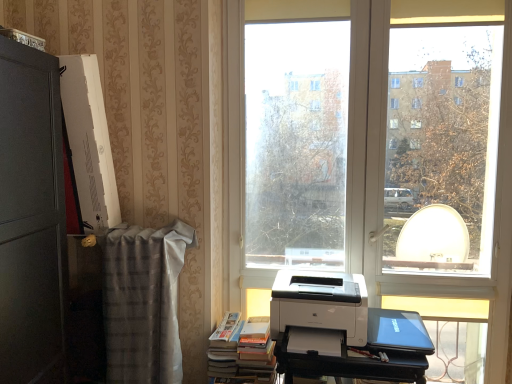
The image size is (512, 384). I want to click on plaid fabric at left, so click(x=143, y=302).

In order to face white glossy printer at center, should I rotate leftwards or rightwards?

To face it directly, rotate right by 8.618 degrees.

Where is `matte black laptop at lower right`? This screenshot has height=384, width=512. matte black laptop at lower right is located at coordinates (398, 331).

Identify the location of plaid fabric at left. (143, 302).

Which object is wider, black plastic printer at lower right or transparent glass window at center?

black plastic printer at lower right.

How much distance is there between black plastic printer at lower right and transparent glass window at center?

They are 32.61 inches apart.

From a real-world perspective, who is located higher, black plastic printer at lower right or transparent glass window at center?

From a 3D spatial view, transparent glass window at center is above.

Considering their positions, is black plastic printer at lower right located in front of or behind transparent glass window at center?

black plastic printer at lower right is positioned closer to the viewer than transparent glass window at center.

Considering the sizes of white glossy printer at center and transparent glass window at center in the image, is white glossy printer at center taller or shorter than transparent glass window at center?

Considering their sizes, white glossy printer at center has less height than transparent glass window at center.

Can we say white glossy printer at center lies outside transparent glass window at center?

Yes, white glossy printer at center is not within transparent glass window at center.

Which is closer, (312, 286) or (343, 223)?

The point (312, 286) is closer to the camera.

Based on their sizes in the image, would you say white glossy printer at center is bigger or smaller than transparent glass window at center?

Considering their sizes, white glossy printer at center takes up less space than transparent glass window at center.

From the image's perspective, would you say black plastic printer at lower right is shown under white glossy printer at center?

Indeed, from the image's perspective, black plastic printer at lower right is shown beneath white glossy printer at center.

From the picture: Considering the sizes of objects black plastic printer at lower right and white glossy printer at center in the image provided, who is thinner, black plastic printer at lower right or white glossy printer at center?

white glossy printer at center.

Who is smaller, black plastic printer at lower right or white glossy printer at center?

white glossy printer at center.

Is black plastic printer at lower right turned away from white glossy printer at center?

No, black plastic printer at lower right is not facing the opposite direction of white glossy printer at center.

Which is behind, point (174, 307) or point (317, 327)?

The point (174, 307) is more distant.

From a real-world perspective, is plaid fabric at left beneath white glossy printer at center?

Yes, from a real-world perspective, plaid fabric at left is under white glossy printer at center.

Considering the relative positions of plaid fabric at left and white glossy printer at center in the image provided, is plaid fabric at left to the right of white glossy printer at center from the viewer's perspective?

No, plaid fabric at left is not to the right of white glossy printer at center.

From the picture: Considering the relative sizes of hardcover books at lower left and white glossy printer at center in the image provided, is hardcover books at lower left bigger than white glossy printer at center?

Indeed, hardcover books at lower left has a larger size compared to white glossy printer at center.

What's the angular difference between hardcover books at lower left and white glossy printer at center's facing directions?

The angle between the facing direction of hardcover books at lower left and the facing direction of white glossy printer at center is 4.56 degrees.

Does hardcover books at lower left appear on the right side of white glossy printer at center?

No.

Does hardcover books at lower left have a lesser height compared to white glossy printer at center?

Incorrect, the height of hardcover books at lower left does not fall short of that of white glossy printer at center.

Which object is closer to the camera taking this photo, black plastic printer at lower right or plaid fabric at left?

black plastic printer at lower right is more forward.

From the image's perspective, is black plastic printer at lower right on top of plaid fabric at left?

Actually, black plastic printer at lower right appears below plaid fabric at left in the image.

From a real-world perspective, is black plastic printer at lower right on plaid fabric at left?

No, from a real-world perspective, black plastic printer at lower right is not on top of plaid fabric at left.

Who is shorter, black plastic printer at lower right or plaid fabric at left?

black plastic printer at lower right.

Which is closer to the camera, (389,339) or (166,232)?

Point (389,339) is farther from the camera than point (166,232).

From the image's perspective, which is below, matte black laptop at lower right or plaid fabric at left?

matte black laptop at lower right.

Locate an element on the screen. The width and height of the screenshot is (512, 384). blanket that is behind the matte black laptop at lower right is located at coordinates (143, 302).

Could you tell me if matte black laptop at lower right is turned towards plaid fabric at left?

No, matte black laptop at lower right is not aimed at plaid fabric at left.

Where is `window screen above the black plastic printer at lower right (from the image's perspective)`? window screen above the black plastic printer at lower right (from the image's perspective) is located at coordinates (296, 143).

You are a GUI agent. You are given a task and a screenshot of the screen. Output one action in this format:
    pyautogui.click(x=<x>, y=<y>)
    Task: Click on the printer to the right of transparent glass window at center
    This screenshot has width=512, height=384.
    Given the screenshot: What is the action you would take?
    pyautogui.click(x=320, y=303)

Based on their spatial positions, is matte black laptop at lower right or black plastic printer at lower right closer to white glossy printer at center?

Based on the image, black plastic printer at lower right appears to be nearer to white glossy printer at center.

From the image, which object appears to be nearer to black plastic printer at lower right, matte black laptop at lower right or plaid fabric at left?

Among the two, matte black laptop at lower right is located nearer to black plastic printer at lower right.

From the image, which object appears to be nearer to white glossy printer at center, matte black laptop at lower right or transparent glass window at center?

matte black laptop at lower right is positioned closer to the anchor white glossy printer at center.

From the image, which object appears to be farther from black plastic printer at lower right, transparent glass window at center or white glossy printer at center?

transparent glass window at center is further to black plastic printer at lower right.

Estimate the real-world distances between objects in this image. Which object is further from matte black laptop at lower right, white glossy printer at center or plaid fabric at left?

plaid fabric at left.

Based on their spatial positions, is black plastic printer at lower right or hardcover books at lower left further from matte black laptop at lower right?

Among the two, hardcover books at lower left is located further to matte black laptop at lower right.

From the image, which object appears to be nearer to black plastic printer at lower right, transparent glass window at center or hardcover books at lower left?

hardcover books at lower left.

From the image, which object appears to be nearer to hardcover books at lower left, transparent glass window at center or white glossy printer at center?

white glossy printer at center is positioned closer to the anchor hardcover books at lower left.

Locate an element on the screen. This screenshot has height=384, width=512. book between plaid fabric at left and matte black laptop at lower right is located at coordinates (242, 352).

Find the location of a particular element. The image size is (512, 384). blanket between transparent glass window at center and black plastic printer at lower right in the up-down direction is located at coordinates (143, 302).

Locate an element on the screen. The image size is (512, 384). table between hardcover books at lower left and matte black laptop at lower right in the horizontal direction is located at coordinates (351, 364).

In order to click on printer between plaid fabric at left and black plastic printer at lower right in the horizontal direction in this screenshot , I will do `click(320, 303)`.